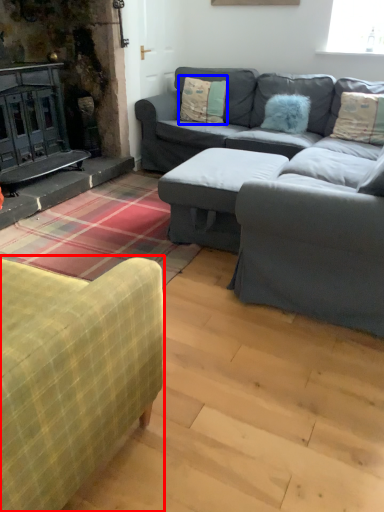
Question: Which object is closer to the camera taking this photo, studio couch (highlighted by a red box) or pillow (highlighted by a blue box)?

Choices:
 (A) studio couch
 (B) pillow

Answer: (A)